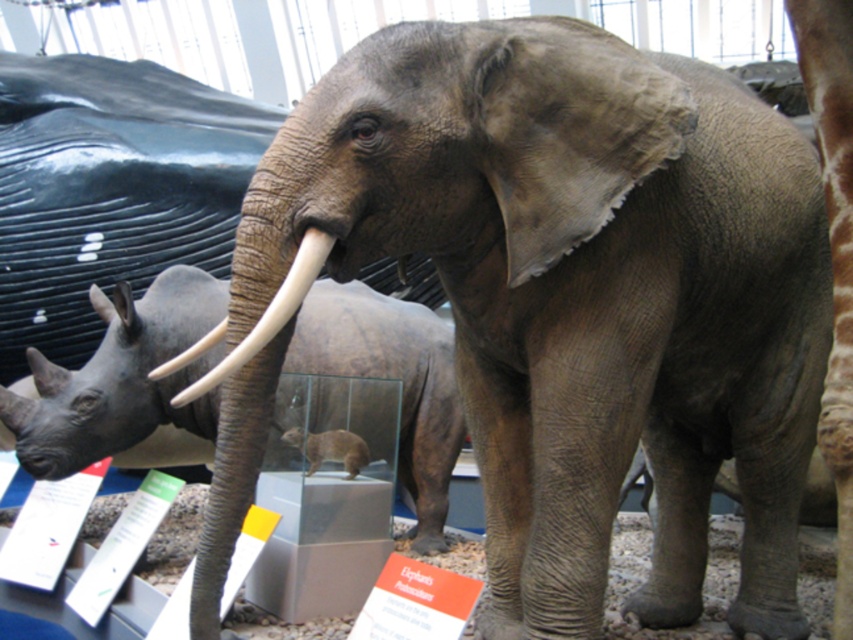
You are a museum security guard who needs to move a 1.5 meter wide barrier between the matte gray rhinoceros at center and the white ivory tusk at center. Can you fit the barrier between them without touching either object?

The distance between the matte gray rhinoceros at center and the white ivory tusk at center is 1.65 meters. Since the barrier is 1.5 meters wide, there is enough space to place it between them without touching either object.

You are an exhibit designer planning to move the matte gray rhinoceros at center and the white ivory tusk at center to a new display case. The case has a width limit of 1.2 meters. Given their sizes, can both items fit side by side without overlapping?

The matte gray rhinoceros at center is wider than the white ivory tusk at center. Since the rhinoceros is already wider than the tusk, and the case is only 1.2 meters wide, it is uncertain if both can fit without knowing their exact widths. However, if the rhinoceros alone exceeds 1.2 meters, they cannot fit. If not, the combined width might still exceed the limit. More specific measurements are needed.

Based on the photo, you are a visitor at the museum and see the elephant and the whale in the diorama. There is a point marked at coordinates (120, 378). Which object is this point located on?

The point at coordinates (120, 378) is located on the matte gray rhinoceros at center.